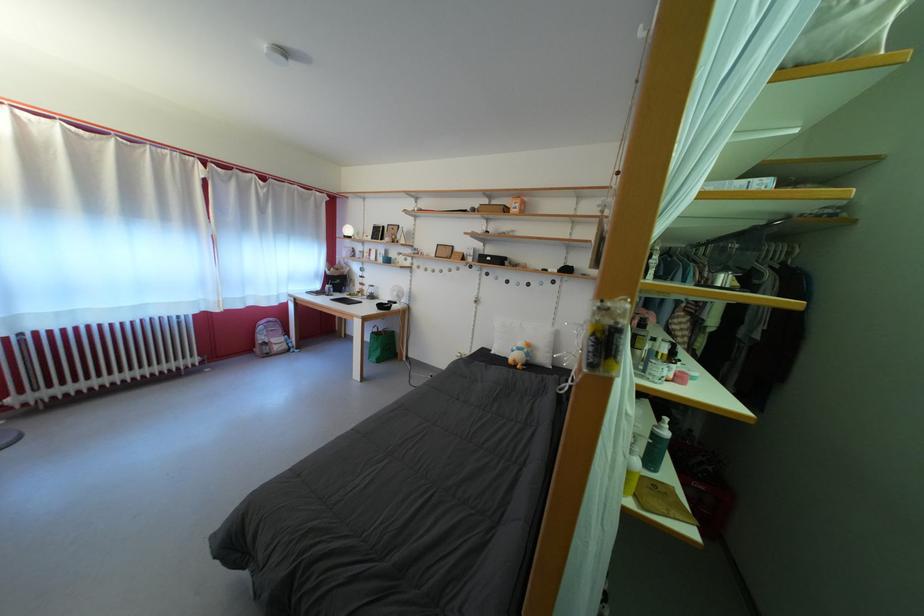
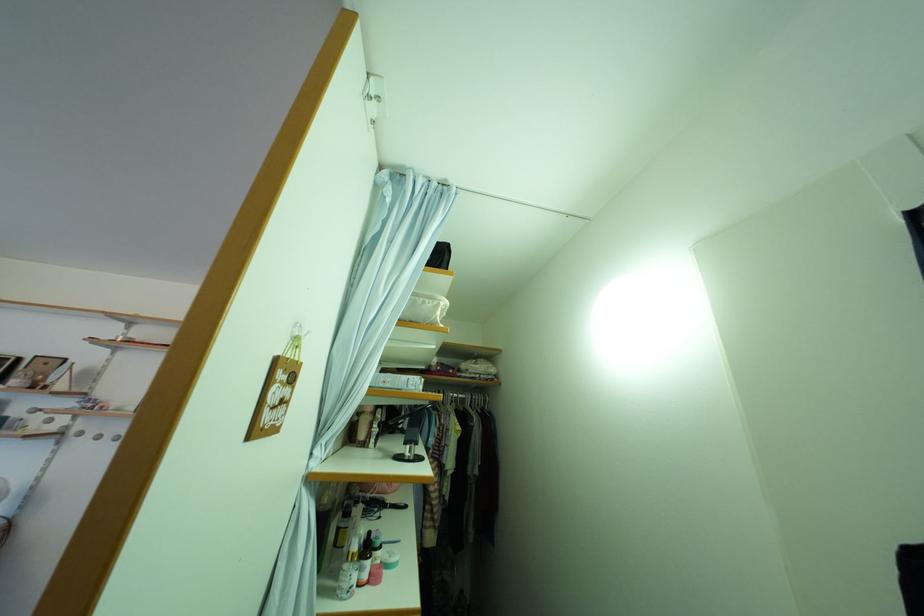
In the second image, find the point that corresponds to pixel 730 282 in the first image.

(417, 454)